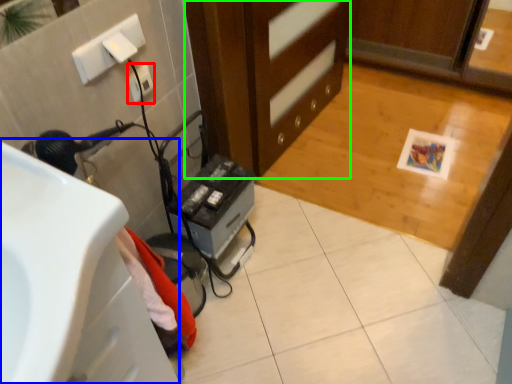
Question: Which object is positioned farthest from electric outlet (highlighted by a red box)? Select from sink (highlighted by a blue box) and cabinetry (highlighted by a green box).

Choices:
 (A) sink
 (B) cabinetry

Answer: (A)